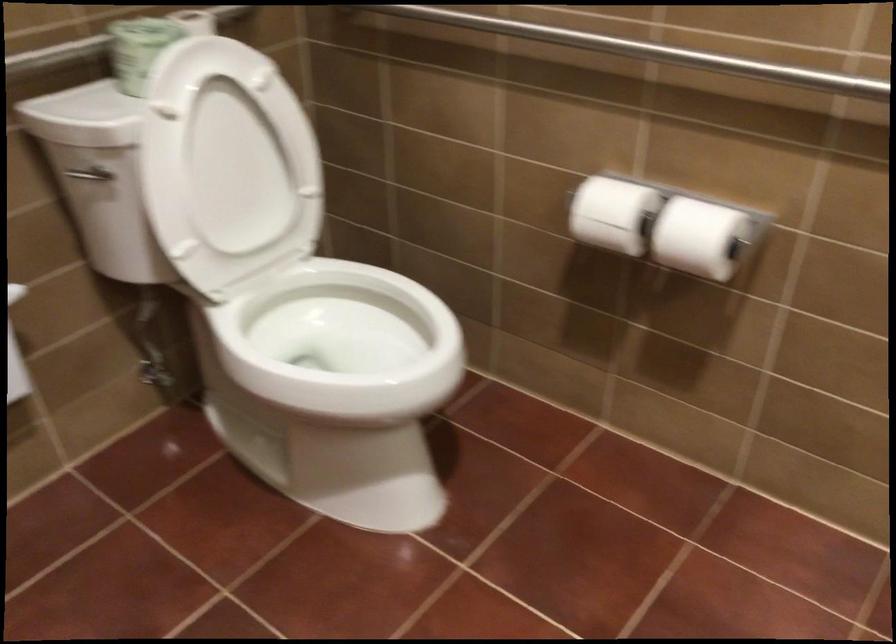
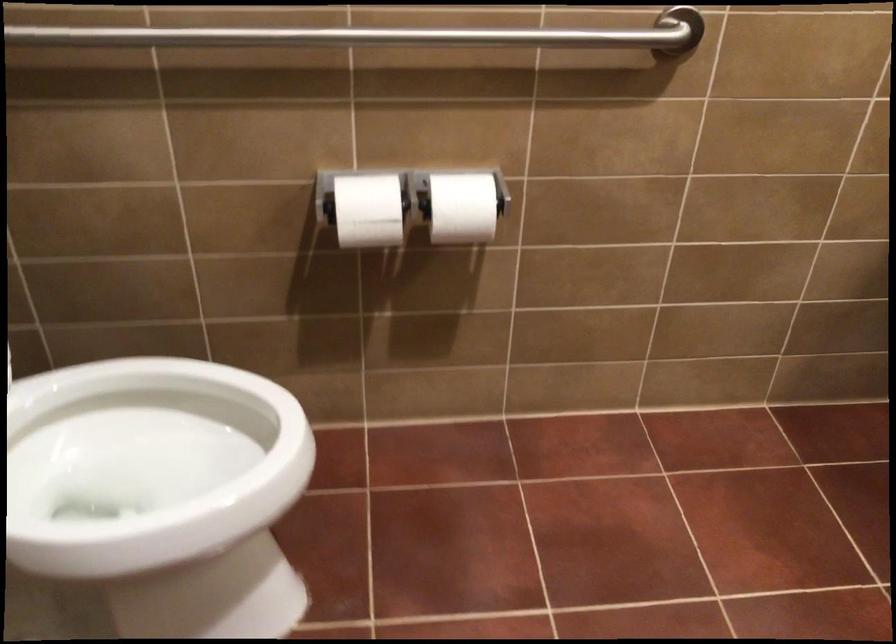
Locate, in the second image, the point that corresponds to (x=600, y=205) in the first image.

(367, 210)